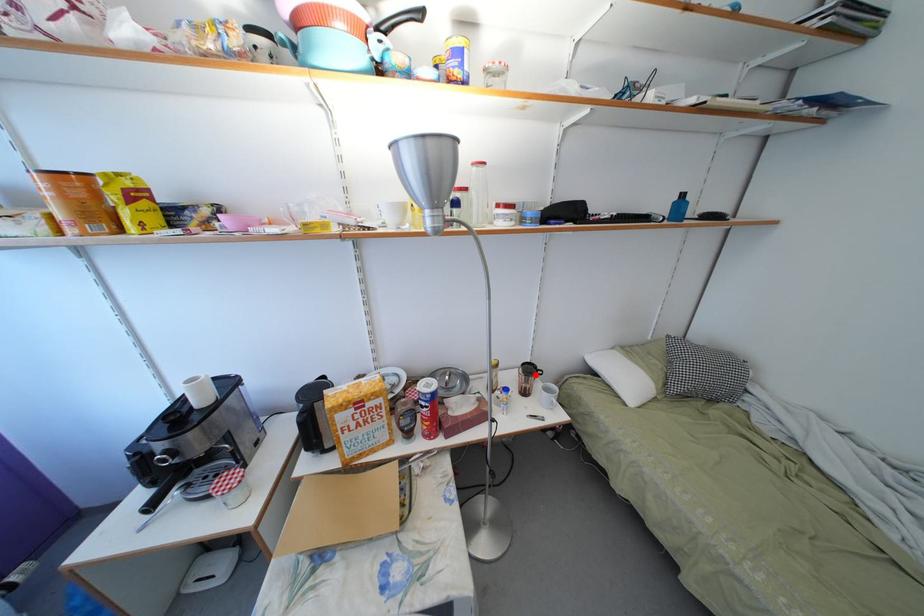
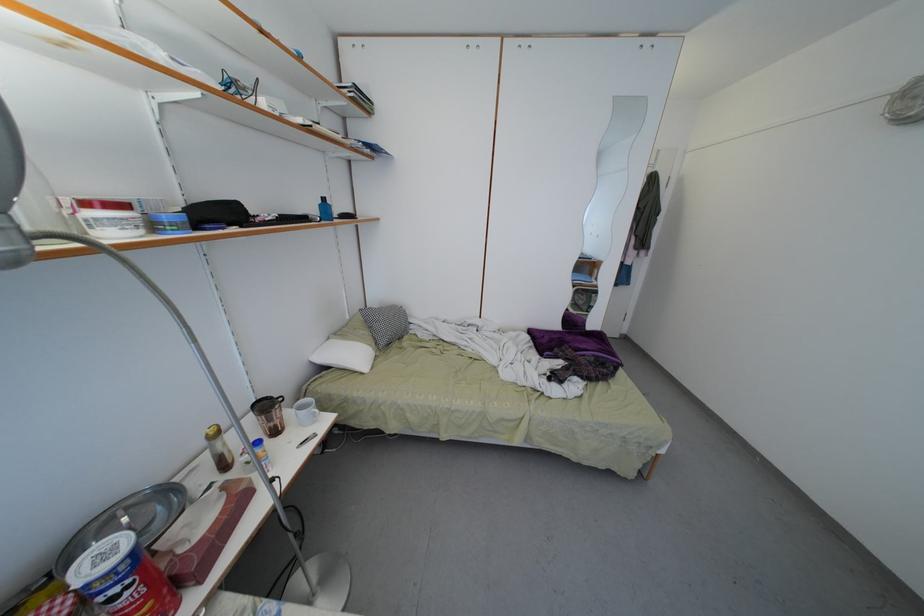
Question: I am providing you with two images of the same scene from different viewpoints. A red point is shown in image1. For the corresponding object point in image2, is it positioned nearer or farther from the camera?

Choices:
 (A) Nearer
 (B) Farther

Answer: (A)